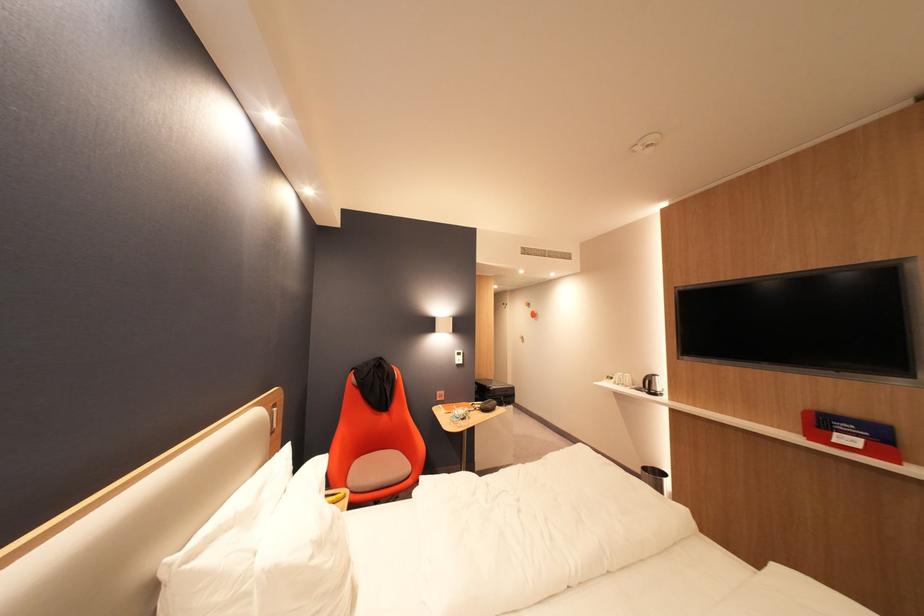
Where is `orange wall hook`? The height and width of the screenshot is (616, 924). orange wall hook is located at coordinates (533, 314).